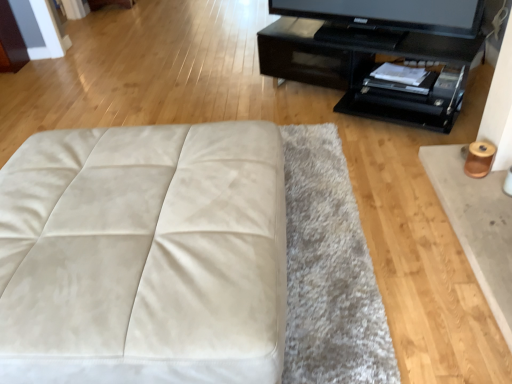
Where is `matte black television at upper right`? The height and width of the screenshot is (384, 512). matte black television at upper right is located at coordinates (386, 18).

From a real-world perspective, who is located lower, white suede ottoman at center or black glossy tv stand at upper right?

From a 3D spatial view, black glossy tv stand at upper right is below.

Can you see white suede ottoman at center touching black glossy tv stand at upper right?

No, white suede ottoman at center is not beside black glossy tv stand at upper right.

Does white suede ottoman at center contain black glossy tv stand at upper right?

No.

Between point (154, 166) and point (275, 70), which one is positioned in front?

The point (154, 166) is in front.

Which is correct: black glossy tv stand at upper right is inside white suede ottoman at center, or outside of it?

black glossy tv stand at upper right is not enclosed by white suede ottoman at center.

In terms of width, does black glossy tv stand at upper right look wider or thinner when compared to white suede ottoman at center?

In the image, black glossy tv stand at upper right appears to be more narrow than white suede ottoman at center.

From a real-world perspective, is black glossy tv stand at upper right physically located above or below white suede ottoman at center?

From a real-world perspective, black glossy tv stand at upper right is physically below white suede ottoman at center.

How many degrees apart are the facing directions of black glossy tv stand at upper right and white suede ottoman at center?

150 degrees.

Is black glossy tv stand at upper right not inside matte black television at upper right?

black glossy tv stand at upper right is positioned outside matte black television at upper right.

Is black glossy tv stand at upper right taller than matte black television at upper right?

Indeed, black glossy tv stand at upper right has a greater height compared to matte black television at upper right.

Based on the photo, could you tell me if black glossy tv stand at upper right is facing matte black television at upper right?

No, black glossy tv stand at upper right is not oriented towards matte black television at upper right.

Is point (103, 332) farther from viewer compared to point (415, 11)?

No, it is not.

From the image's perspective, is white suede ottoman at center beneath matte black television at upper right?

Yes, from the image's perspective, white suede ottoman at center is beneath matte black television at upper right.

From a real-world perspective, who is located lower, white suede ottoman at center or matte black television at upper right?

From a 3D spatial view, white suede ottoman at center is below.

Does white suede ottoman at center have a smaller size compared to matte black television at upper right?

No, white suede ottoman at center is not smaller than matte black television at upper right.

Considering the relative sizes of matte black television at upper right and black glossy tv stand at upper right in the image provided, is matte black television at upper right thinner than black glossy tv stand at upper right?

Indeed, matte black television at upper right has a lesser width compared to black glossy tv stand at upper right.

Where is `television behind the black glossy tv stand at upper right`? The height and width of the screenshot is (384, 512). television behind the black glossy tv stand at upper right is located at coordinates (386, 18).

From the image's perspective, is matte black television at upper right above black glossy tv stand at upper right?

Yes, from the image's perspective, matte black television at upper right is above black glossy tv stand at upper right.

From their relative heights in the image, would you say matte black television at upper right is taller or shorter than white suede ottoman at center?

Clearly, matte black television at upper right is shorter compared to white suede ottoman at center.

Is matte black television at upper right facing towards white suede ottoman at center?

Yes, matte black television at upper right is facing white suede ottoman at center.

From the image's perspective, is matte black television at upper right on white suede ottoman at center?

Yes.

Based on the photo, considering the sizes of objects matte black television at upper right and white suede ottoman at center in the image provided, who is wider, matte black television at upper right or white suede ottoman at center?

white suede ottoman at center is wider.

The height and width of the screenshot is (384, 512). I want to click on furniture in front of the black glossy tv stand at upper right, so click(143, 255).

Identify the location of furniture below the black glossy tv stand at upper right (from the image's perspective). (143, 255).

From the image, which object appears to be farther from matte black television at upper right, white suede ottoman at center or black glossy tv stand at upper right?

white suede ottoman at center lies further to matte black television at upper right than the other object.

From the image, which object appears to be nearer to white suede ottoman at center, matte black television at upper right or black glossy tv stand at upper right?

black glossy tv stand at upper right.

Estimate the real-world distances between objects in this image. Which object is further from white suede ottoman at center, black glossy tv stand at upper right or matte black television at upper right?

Based on the image, matte black television at upper right appears to be further to white suede ottoman at center.

Based on their spatial positions, is black glossy tv stand at upper right or white suede ottoman at center closer to matte black television at upper right?

black glossy tv stand at upper right is positioned closer to the anchor matte black television at upper right.

When comparing their distances from black glossy tv stand at upper right, does white suede ottoman at center or matte black television at upper right seem closer?

Among the two, matte black television at upper right is located nearer to black glossy tv stand at upper right.

Considering their positions, is matte black television at upper right positioned closer to black glossy tv stand at upper right than white suede ottoman at center?

matte black television at upper right.

What are the coordinates of `table positioned between white suede ottoman at center and matte black television at upper right from near to far` in the screenshot? It's located at (356, 66).